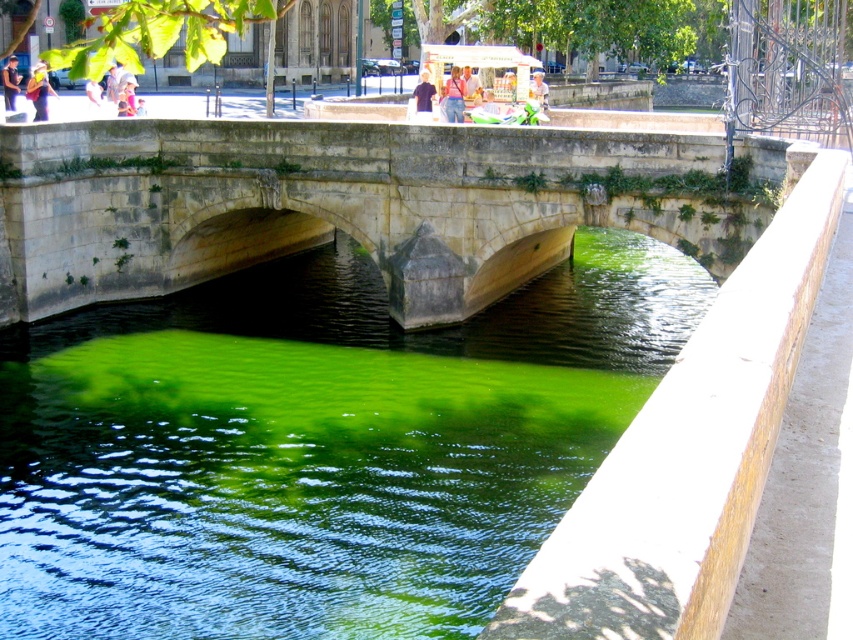
Question: Can you confirm if green algae at center is positioned above stone bridge at center?

Choices:
 (A) no
 (B) yes

Answer: (A)

Question: Does green algae at center appear on the left side of stone bridge at center?

Choices:
 (A) no
 (B) yes

Answer: (B)

Question: Does green algae at center come in front of stone bridge at center?

Choices:
 (A) no
 (B) yes

Answer: (B)

Question: Which point is closer to the camera taking this photo?

Choices:
 (A) (302, 419)
 (B) (244, 170)

Answer: (A)